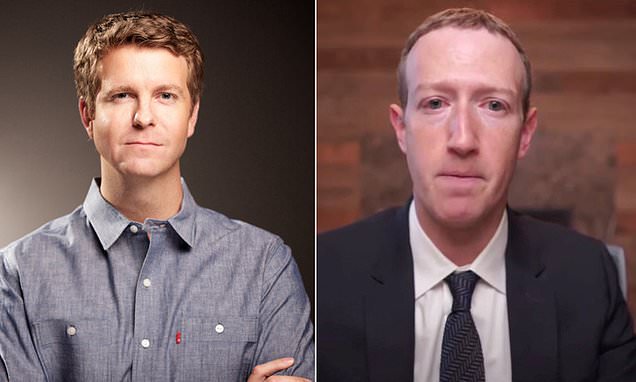
Can you point out all where a pen might be put in in this image? Your answer should be formatted as a list of tuples, i.e. [(x1, y1), (x2, y2), ...], where each tuple contains the x and y coordinates of a point satisfying the conditions above.

[(71, 351), (217, 356)]